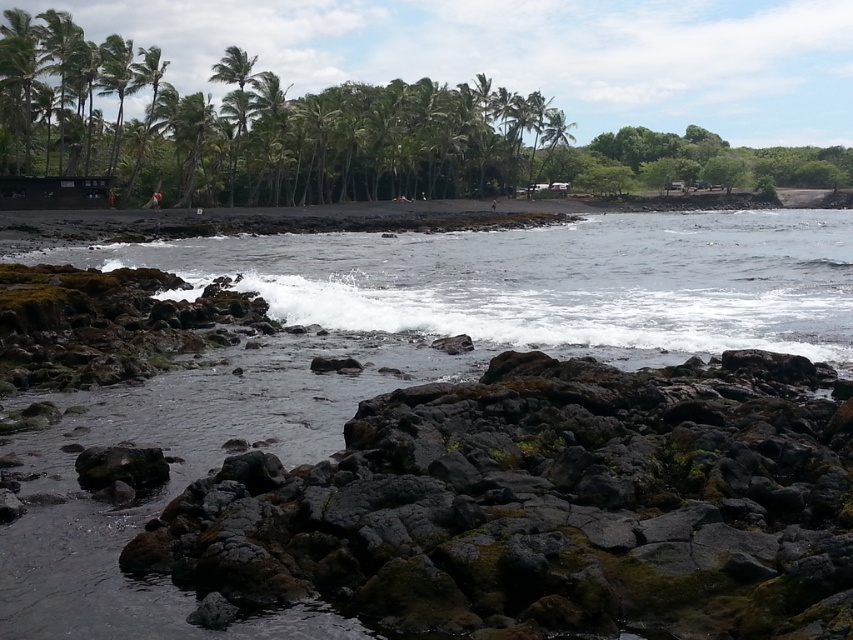
You are standing on the black sand beach and want to take a photo of both the mossy rock at center and the green leafy palm tree at upper left. Which object should you zoom in on first to ensure both are in frame?

You should zoom in on the mossy rock at center first because it is shorter than the green leafy palm tree at upper left, so adjusting the frame to include the taller palm tree will automatically include the shorter rock.

You are standing at the edge of the black sand beach and want to place a small flag exactly where the mossy rock at center is located. Given that your current position is at coordinate point 0,0, and the coordinate system extends to 1,1 in all directions, can you determine the exact coordinates where you should place the flag?

The mossy rock at center is located at coordinate point [547,506], so you should place the flag at that exact position.